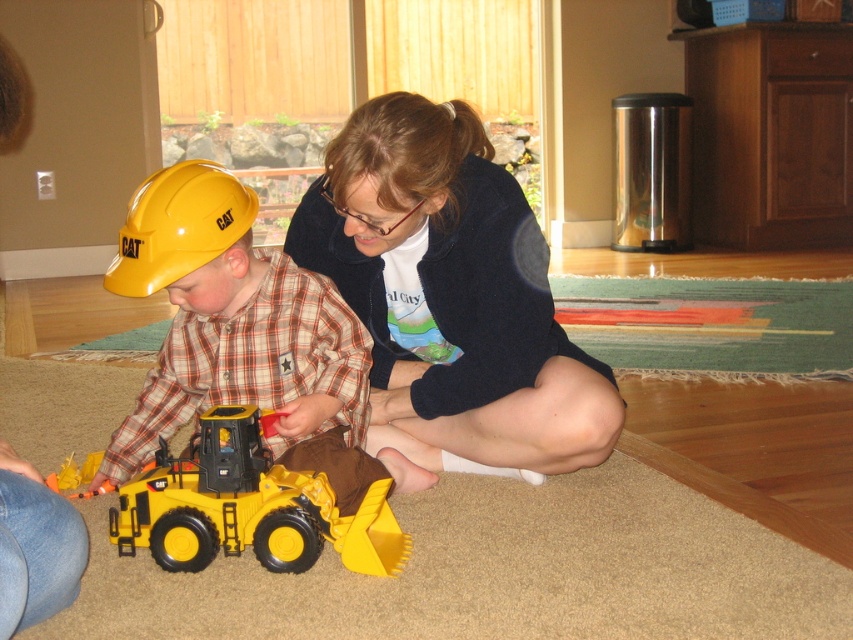
Is matte blue sweater at center closer to the viewer compared to matte yellow construction helmet at left?

Yes, matte blue sweater at center is in front of matte yellow construction helmet at left.

Does matte blue sweater at center have a greater height compared to matte yellow construction helmet at left?

Yes.

Is point (480, 160) closer to viewer compared to point (200, 221)?

No, it is not.

You are a GUI agent. You are given a task and a screenshot of the screen. Output one action in this format:
    pyautogui.click(x=<x>, y=<y>)
    Task: Click on the matte blue sweater at center
    This screenshot has width=853, height=640.
    Given the screenshot: What is the action you would take?
    pyautogui.click(x=450, y=300)

Can you confirm if matte yellow construction helmet at left is wider than yellow plastic toy at center?

Indeed, matte yellow construction helmet at left has a greater width compared to yellow plastic toy at center.

Does point (300, 454) come farther from viewer compared to point (173, 541)?

Yes, point (300, 454) is farther from viewer.

The image size is (853, 640). I want to click on matte yellow construction helmet at left, so click(238, 332).

Who is positioned more to the right, matte blue sweater at center or yellow plastic toy at center?

matte blue sweater at center

Who is more forward, (488, 388) or (231, 481)?

Point (231, 481) is in front.

This screenshot has height=640, width=853. Identify the location of matte blue sweater at center. (450, 300).